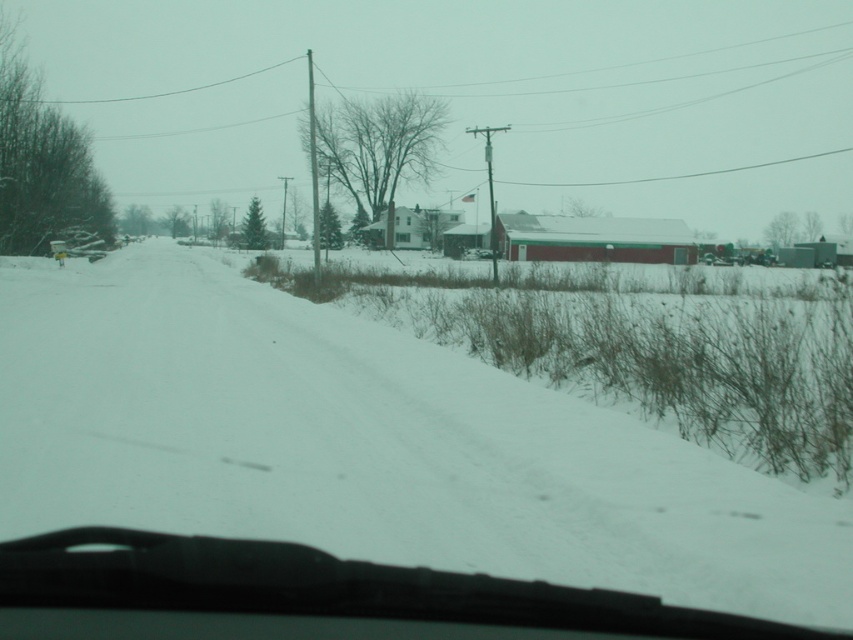
You are driving a car and see the white powdery snow at center and the transparent rubber windshield at center through your window. Which object is closer to you?

The transparent rubber windshield at center is closer to you because it is between you and the white powdery snow at center.

You are driving a car and looking through the windshield. There is a point marked at coordinates (369, 445). What is located at that point?

The white powdery snow at center is located at point (369, 445).